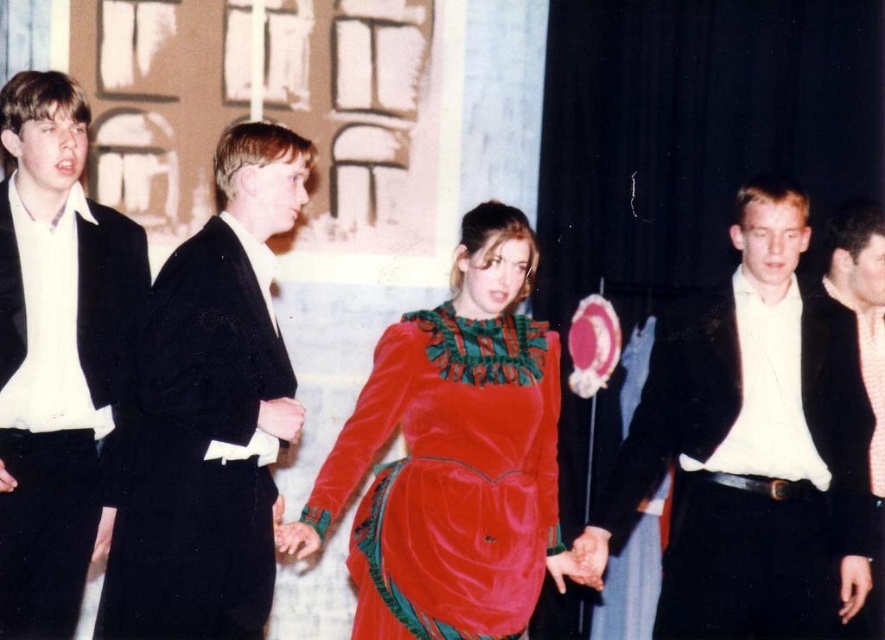
Question: Which point is farther from the camera taking this photo?

Choices:
 (A) (41, 205)
 (B) (514, 612)
 (C) (244, 266)

Answer: (A)

Question: Is shiny black suit at right further to the viewer compared to matte black suit at right?

Choices:
 (A) no
 (B) yes

Answer: (A)

Question: Which object appears closest to the camera in this image?

Choices:
 (A) velvet dress at center
 (B) matte black suit at right
 (C) velvet black suit at left

Answer: (A)

Question: Is shiny black suit at right closer to camera compared to velvet black suit at left?

Choices:
 (A) no
 (B) yes

Answer: (A)

Question: In this image, where is velvet dress at center located relative to velvet black suit at left?

Choices:
 (A) below
 (B) above

Answer: (A)

Question: Which of the following is the closest to the observer?

Choices:
 (A) matte black suit at right
 (B) velvet dress at center

Answer: (B)